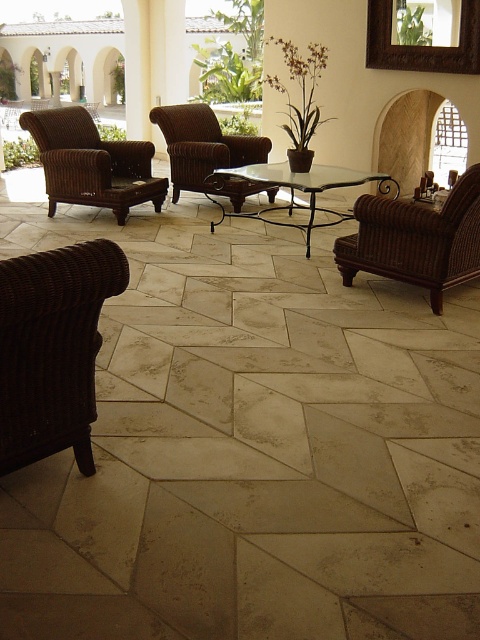
Question: Which object is closer to the camera taking this photo?

Choices:
 (A) natural stone tile at center
 (B) woven brown armchair at right
 (C) brown wicker armchair at left
 (D) dark brown woven armchair at lower left

Answer: (A)

Question: Which point is farther to the camera?

Choices:
 (A) brown wicker armchair at left
 (B) clear glass table at center
 (C) natural stone tile at center
 (D) woven brown armchair at right

Answer: (A)

Question: Does natural stone tile at center lie in front of woven brown armchair at right?

Choices:
 (A) no
 (B) yes

Answer: (B)

Question: Which is farther from the dark brown woven armchair at lower left?

Choices:
 (A) woven brown armchair at right
 (B) natural stone tile at center
 (C) clear glass table at center
 (D) brown wicker armchair at center

Answer: (D)

Question: Is woven brown armchair at right bigger than clear glass table at center?

Choices:
 (A) yes
 (B) no

Answer: (B)

Question: Is dark brown woven armchair at lower left closer to camera compared to brown wicker armchair at left?

Choices:
 (A) yes
 (B) no

Answer: (A)